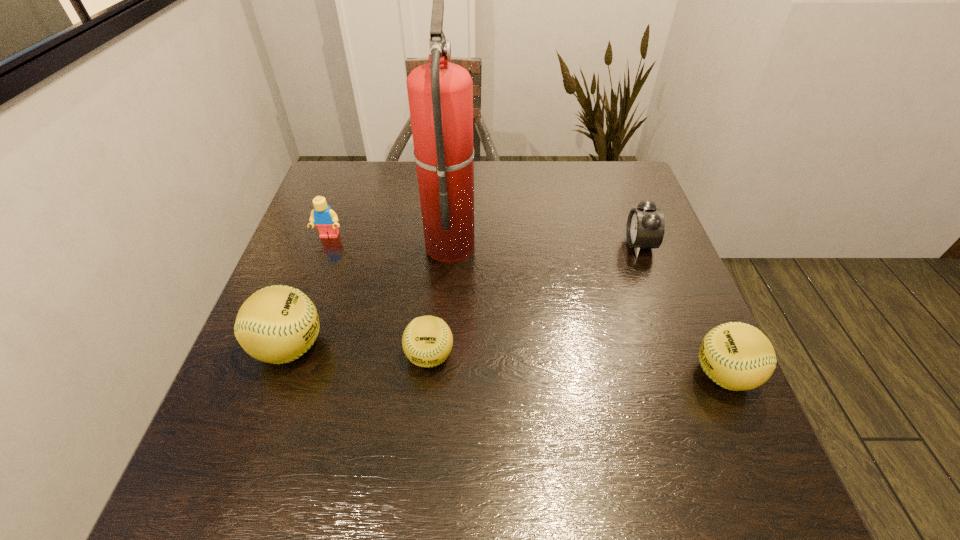
Please point a spot to place another softball for symmetrical spacing. Please provide its 2D coordinates. Your answer should be formatted as a tuple, i.e. [(x, y)], where the tuple contains the x and y coordinates of a point satisfying the conditions above.

[(574, 365)]